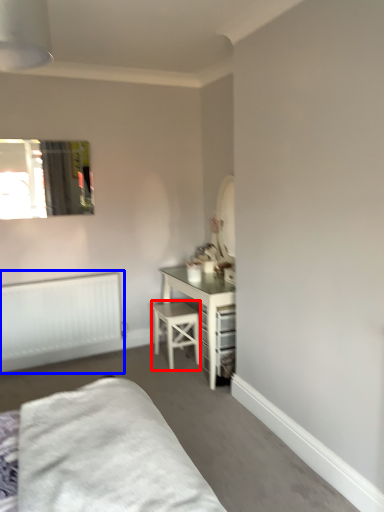
Question: Which point is further to the camera, stool (highlighted by a red box) or radiator (highlighted by a blue box)?

Choices:
 (A) stool
 (B) radiator

Answer: (A)